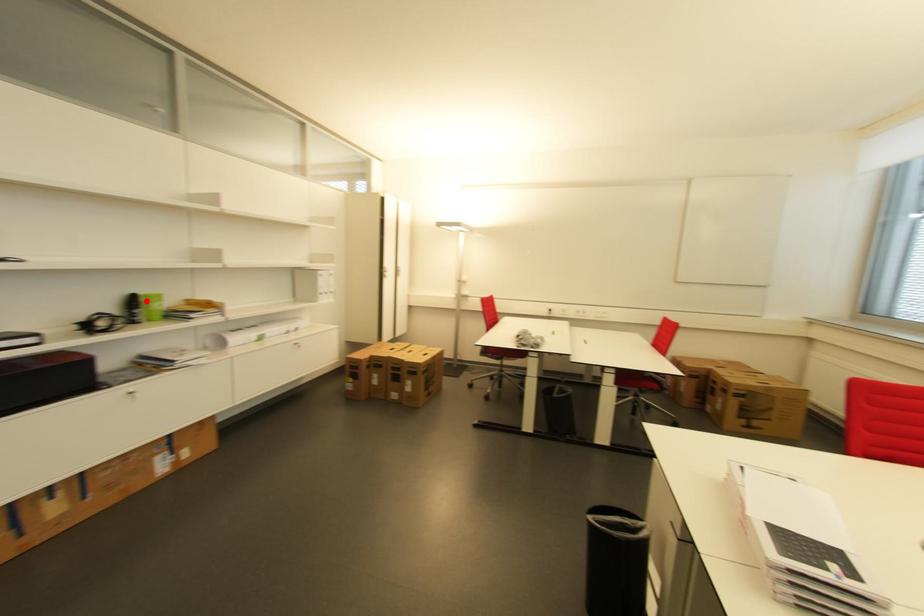
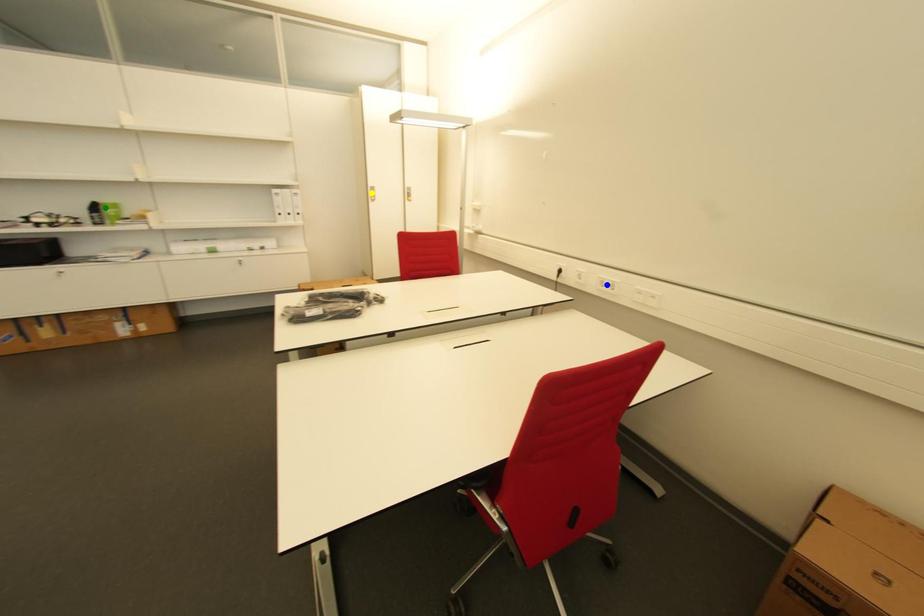
Question: I am providing you with two images of the same scene from different viewpoints. A red point is marked on the first image. You are given multiple points on the second image. Which point in image 2 is actually the same real-world point as the red point in image 1?

Choices:
 (A) green point
 (B) yellow point
 (C) blue point

Answer: (A)